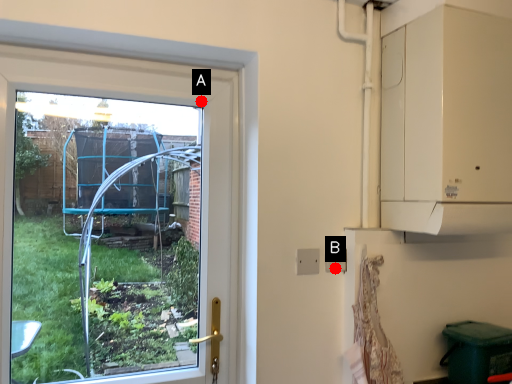
Question: Two points are circled on the image, labeled by A and B beside each circle. Which point is further to the camera?

Choices:
 (A) A is further
 (B) B is further

Answer: (A)